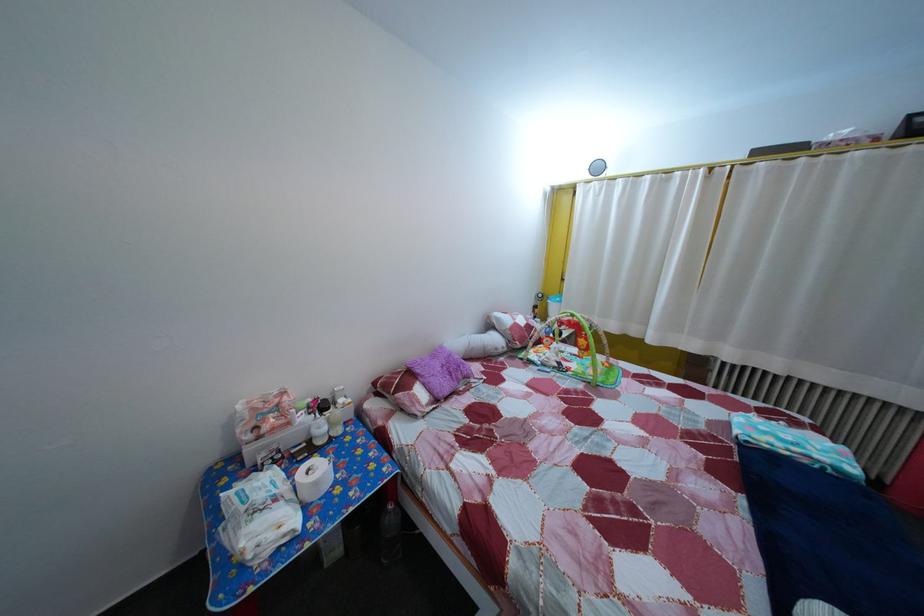
This screenshot has height=616, width=924. Identify the location of black water bottle. (390, 533).